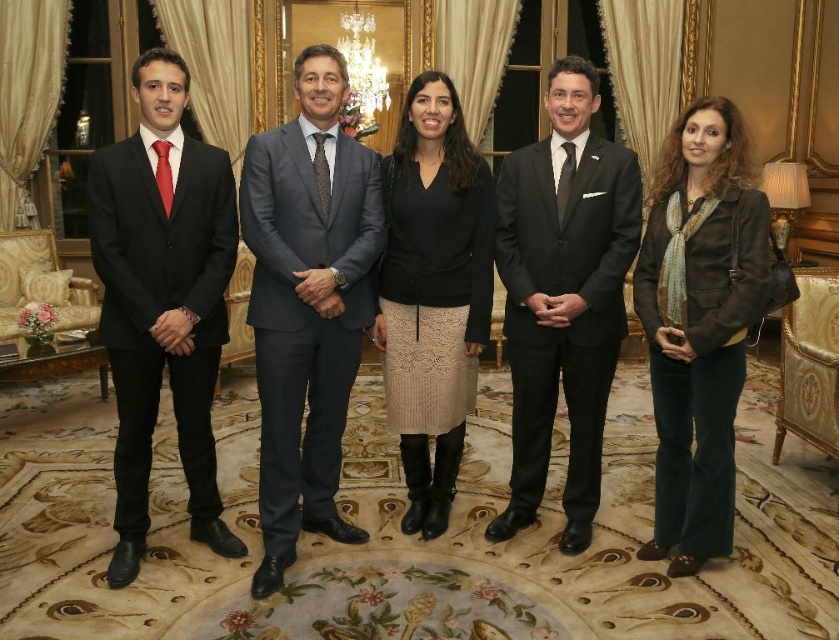
Who is positioned more to the right, gray suit at center or black satin suit at center?

black satin suit at center

What do you see at coordinates (306, 304) in the screenshot? This screenshot has width=839, height=640. I see `gray suit at center` at bounding box center [306, 304].

Is point (332, 394) less distant than point (574, 493)?

Yes, it is in front of point (574, 493).

Locate an element on the screen. The image size is (839, 640). gray suit at center is located at coordinates (306, 304).

Does black satin suit at center lie behind velvet brown jacket at center?

Yes, it is.

Between point (540, 225) and point (659, 422), which one is positioned in front?

Point (659, 422) is more forward.

You are a GUI agent. You are given a task and a screenshot of the screen. Output one action in this format:
    pyautogui.click(x=<x>, y=<y>)
    Task: Click on the black satin suit at center
    This screenshot has width=839, height=640.
    Given the screenshot: What is the action you would take?
    pyautogui.click(x=563, y=296)

Looking at this image, can you confirm if matte black suit at left is positioned above black lace skirt at center?

Incorrect, matte black suit at left is not positioned above black lace skirt at center.

In the scene shown: Measure the distance between point (118, 470) and camera.

Point (118, 470) and camera are 9.24 feet apart from each other.

The image size is (839, 640). I want to click on matte black suit at left, so click(162, 300).